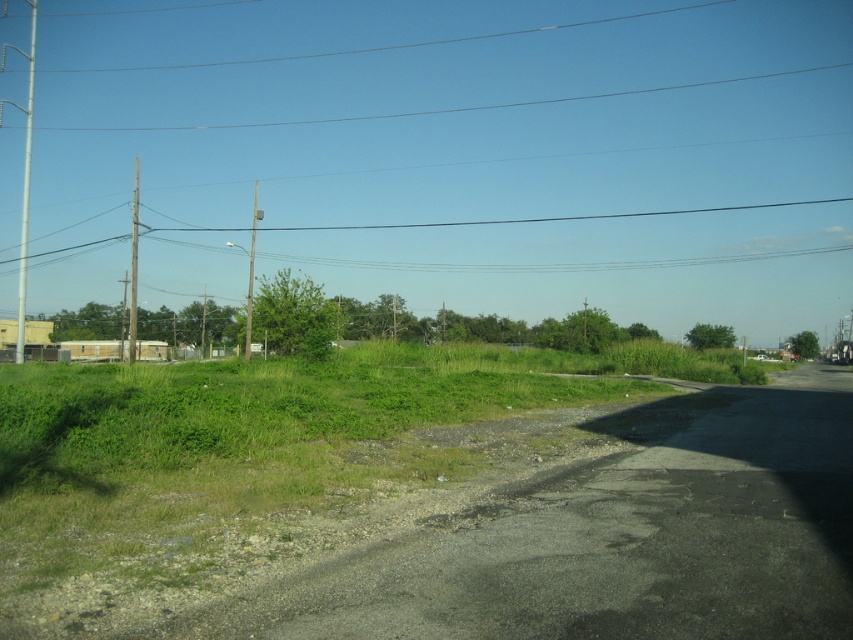
You are a bird flying over the scene and want to land on a pole. Which pole, the silver metallic pole at left or the wooden telegraph pole at left, is higher and thus offers a better vantage point?

The silver metallic pole at left is above the wooden telegraph pole at left, so it offers a better vantage point.

You are a maintenance worker needing to replace a pole. You have a 15 meter long ladder. The wooden telegraph pole at left and smooth gray pole at center are in your way. Can you safely place the ladder between them without it touching either pole?

The wooden telegraph pole at left and smooth gray pole at center are 14.57 meters apart from each other. The ladder is 15 meters long, which is slightly longer than the distance between the poles. Therefore, the ladder cannot be safely placed between them without touching at least one of the poles.

You are a gardener who needs to plant a new tree between the green grassy at lower left and the wooden telegraph pole at left. The tree requires a minimum of 20 meters of space between it and any nearby structures. Based on the scene, can you safely plant the tree in this location?

The green grassy at lower left is 18.64 meters from the wooden telegraph pole at left. Since the required minimum distance is 20 meters, planting the tree here would not meet the safety requirement as the distance is insufficient.